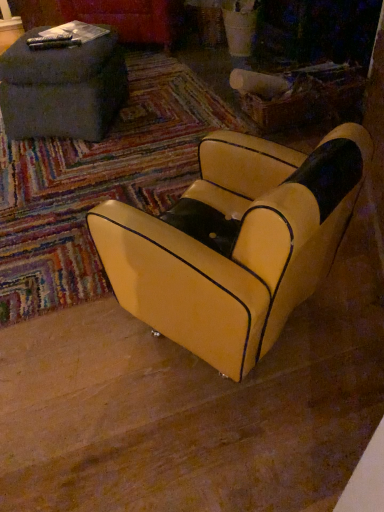
The width and height of the screenshot is (384, 512). What do you see at coordinates (62, 89) in the screenshot? I see `dark gray fabric ottoman at upper left` at bounding box center [62, 89].

The width and height of the screenshot is (384, 512). I want to click on dark gray fabric ottoman at upper left, so click(62, 89).

Measure the distance between dark gray fabric ottoman at upper left and camera.

dark gray fabric ottoman at upper left is 1.81 meters away from camera.

What is the approximate height of dark gray fabric ottoman at upper left?

dark gray fabric ottoman at upper left is 15.02 inches tall.

Measure the distance between point (281, 270) and camera.

The distance of point (281, 270) from camera is 29.69 inches.

Describe the element at coordinates (235, 243) in the screenshot. This screenshot has height=512, width=384. I see `yellow leather chair at center` at that location.

In order to face yellow leather chair at center, should I rotate leftwards or rightwards?

To align with it, rotate right about 4.375°.

What are the coordinates of `yellow leather chair at center` in the screenshot? It's located at (235, 243).

At what (x,y) coordinates should I click in order to perform the action: click on dark gray fabric ottoman at upper left. Please return your answer as a coordinate pair (x, y). The width and height of the screenshot is (384, 512). Looking at the image, I should click on (62, 89).

Considering the positions of objects yellow leather chair at center and dark gray fabric ottoman at upper left in the image provided, who is more to the right, yellow leather chair at center or dark gray fabric ottoman at upper left?

yellow leather chair at center is more to the right.

Considering the positions of objects yellow leather chair at center and dark gray fabric ottoman at upper left in the image provided, who is in front, yellow leather chair at center or dark gray fabric ottoman at upper left?

yellow leather chair at center.

Is point (299, 193) closer or farther from the camera than point (77, 99)?

Point (299, 193).

From the image's perspective, is yellow leather chair at center located above or below dark gray fabric ottoman at upper left?

From the image's perspective, yellow leather chair at center appears below dark gray fabric ottoman at upper left.

Consider the image. From a real-world perspective, who is located higher, yellow leather chair at center or dark gray fabric ottoman at upper left?

yellow leather chair at center, from a real-world perspective.

From the picture: Does yellow leather chair at center have a greater width compared to dark gray fabric ottoman at upper left?

No, yellow leather chair at center is not wider than dark gray fabric ottoman at upper left.

Who is shorter, yellow leather chair at center or dark gray fabric ottoman at upper left?

With less height is dark gray fabric ottoman at upper left.

Which of these two, yellow leather chair at center or dark gray fabric ottoman at upper left, is smaller?

dark gray fabric ottoman at upper left is smaller.

Is yellow leather chair at center inside the boundaries of dark gray fabric ottoman at upper left, or outside?

yellow leather chair at center is not inside dark gray fabric ottoman at upper left, it's outside.

Is yellow leather chair at center directly adjacent to dark gray fabric ottoman at upper left?

No, yellow leather chair at center is not with dark gray fabric ottoman at upper left.

Is yellow leather chair at center looking in the opposite direction of dark gray fabric ottoman at upper left?

No, yellow leather chair at center is not facing away from dark gray fabric ottoman at upper left.

How different are the orientations of yellow leather chair at center and dark gray fabric ottoman at upper left in degrees?

The angular difference between yellow leather chair at center and dark gray fabric ottoman at upper left is 28.6 degrees.

Measure the distance from yellow leather chair at center to dark gray fabric ottoman at upper left.

1.22 meters.

Locate an element on the screen. chair below the dark gray fabric ottoman at upper left (from the image's perspective) is located at coordinates (235, 243).

From the picture: Is dark gray fabric ottoman at upper left to the right of yellow leather chair at center from the viewer's perspective?

No, dark gray fabric ottoman at upper left is not to the right of yellow leather chair at center.

Does dark gray fabric ottoman at upper left come behind yellow leather chair at center?

Yes, dark gray fabric ottoman at upper left is further from the viewer.

Does point (82, 67) come in front of point (305, 205)?

No.

From the image's perspective, who appears lower, dark gray fabric ottoman at upper left or yellow leather chair at center?

yellow leather chair at center appears lower in the image.

From a real-world perspective, is dark gray fabric ottoman at upper left over yellow leather chair at center?

Actually, dark gray fabric ottoman at upper left is physically below yellow leather chair at center in the real world.

Which of these two, dark gray fabric ottoman at upper left or yellow leather chair at center, is wider?

With larger width is dark gray fabric ottoman at upper left.

Looking at this image, can you confirm if dark gray fabric ottoman at upper left is shorter than yellow leather chair at center?

Correct, dark gray fabric ottoman at upper left is not as tall as yellow leather chair at center.

Does dark gray fabric ottoman at upper left have a smaller size compared to yellow leather chair at center?

Yes.

Do you think dark gray fabric ottoman at upper left is within yellow leather chair at center, or outside of it?

dark gray fabric ottoman at upper left cannot be found inside yellow leather chair at center.

Is dark gray fabric ottoman at upper left next to yellow leather chair at center and touching it?

No, dark gray fabric ottoman at upper left is not touching yellow leather chair at center.

Is dark gray fabric ottoman at upper left positioned with its back to yellow leather chair at center?

No, dark gray fabric ottoman at upper left's orientation is not away from yellow leather chair at center.

How different are the orientations of dark gray fabric ottoman at upper left and yellow leather chair at center in degrees?

The angular difference between dark gray fabric ottoman at upper left and yellow leather chair at center is 28.6 degrees.

How far apart are dark gray fabric ottoman at upper left and yellow leather chair at center?

They are 4.01 feet apart.

You are a GUI agent. You are given a task and a screenshot of the screen. Output one action in this format:
    pyautogui.click(x=<x>, y=<y>)
    Task: Click on the table directly beneath the yellow leather chair at center (from a real-world perspective)
    
    Given the screenshot: What is the action you would take?
    pyautogui.click(x=62, y=89)

Where is `chair on the right of dark gray fabric ottoman at upper left`? This screenshot has width=384, height=512. chair on the right of dark gray fabric ottoman at upper left is located at coordinates (235, 243).

Identify the location of table located above the yellow leather chair at center (from the image's perspective). (62, 89).